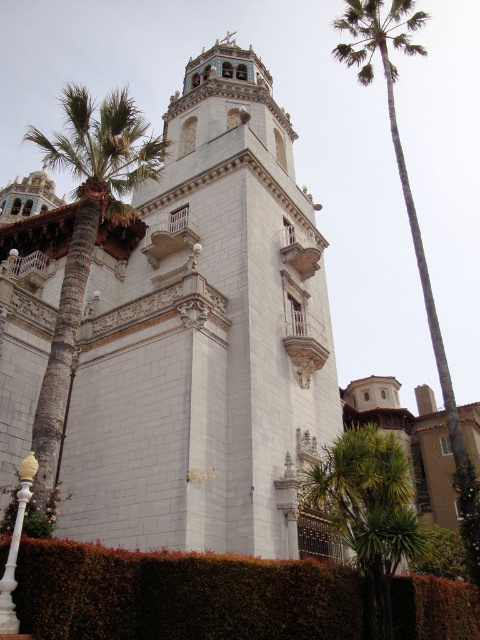
Question: Among these points, which one is nearest to the camera?

Choices:
 (A) (52, 157)
 (B) (340, 493)
 (C) (287, 428)

Answer: (B)

Question: Which of the following is the closest to the observer?

Choices:
 (A) green leafy hedge at lower center
 (B) green leafy palm tree at right

Answer: (A)

Question: Is white stone tower at center to the left of green leafy palm tree at left from the viewer's perspective?

Choices:
 (A) no
 (B) yes

Answer: (A)

Question: Can you confirm if white stone tower at center is thinner than green leafy palm tree at right?

Choices:
 (A) no
 (B) yes

Answer: (A)

Question: Which point is farther to the camera?

Choices:
 (A) (76, 324)
 (B) (201, 490)
 (C) (392, 72)
 (D) (478, 605)

Answer: (C)

Question: Is green leafy hedge at lower center above green leafy palm tree at lower right?

Choices:
 (A) yes
 (B) no

Answer: (B)